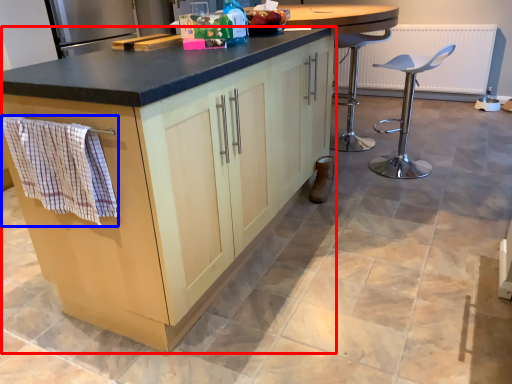
Question: Which of the following is the farthest to the observer, cabinetry (highlighted by a red box) or hand towel (highlighted by a blue box)?

Choices:
 (A) cabinetry
 (B) hand towel

Answer: (B)